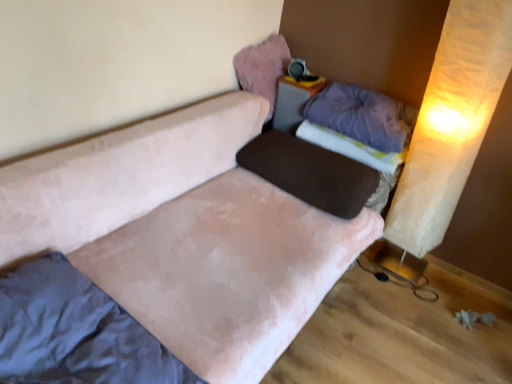
Where is `free point in front of beige paper curtain at right`? The height and width of the screenshot is (384, 512). free point in front of beige paper curtain at right is located at coordinates (400, 298).